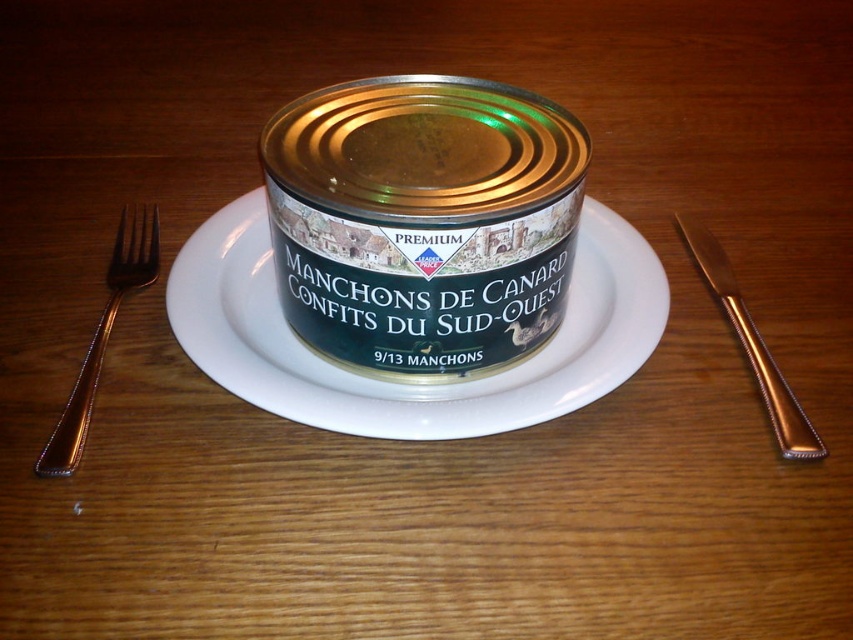
Is gold polished fork at left further to the viewer compared to gold metallic knife at right?

No.

Is gold polished fork at left to the left of gold metallic knife at right from the viewer's perspective?

Correct, you'll find gold polished fork at left to the left of gold metallic knife at right.

Which is in front, point (120, 280) or point (728, 308)?

Point (728, 308) is in front.

Identify the location of gold polished fork at left. (103, 333).

Does white ceramic plate at center come in front of gold metallic knife at right?

Yes, it is in front of gold metallic knife at right.

Is white ceramic plate at center taller than gold metallic knife at right?

No.

Where is `white ceramic plate at center`? white ceramic plate at center is located at coordinates (393, 380).

Can you confirm if white ceramic plate at center is positioned below gold polished fork at left?

No.

Is white ceramic plate at center positioned before gold polished fork at left?

That is True.

Who is more distant from viewer, (619,324) or (90,371)?

Positioned behind is point (619,324).

Identify the location of white ceramic plate at center. (393, 380).